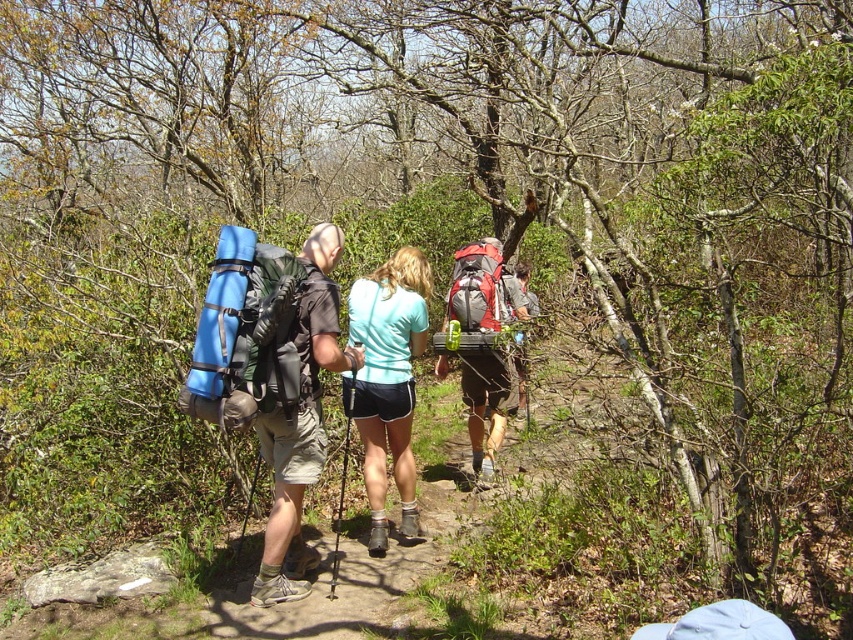
Measure the distance from blue padded backpack at left to red fabric backpack at center.

They are 7.55 feet apart.

Who is positioned more to the right, blue padded backpack at left or red fabric backpack at center?

From the viewer's perspective, red fabric backpack at center appears more on the right side.

Is point (258, 243) more distant than point (485, 323)?

No.

The image size is (853, 640). I want to click on blue padded backpack at left, so click(x=247, y=333).

Measure the distance between matte black backpack at left and camera.

4.15 meters

Can you confirm if matte black backpack at left is positioned to the left of red fabric backpack at center?

Yes, matte black backpack at left is to the left of red fabric backpack at center.

At what (x,y) coordinates should I click in order to perform the action: click on matte black backpack at left. Please return your answer as a coordinate pair (x, y). This screenshot has height=640, width=853. Looking at the image, I should click on (300, 422).

Find the location of a particular element. This screenshot has height=640, width=853. matte black backpack at left is located at coordinates point(300,422).

Can you confirm if blue padded backpack at left is positioned below teal fabric shorts at center?

Incorrect, blue padded backpack at left is not positioned below teal fabric shorts at center.

Describe the element at coordinates (247, 333) in the screenshot. I see `blue padded backpack at left` at that location.

Describe the element at coordinates (247, 333) in the screenshot. I see `blue padded backpack at left` at that location.

The width and height of the screenshot is (853, 640). Identify the location of blue padded backpack at left. (247, 333).